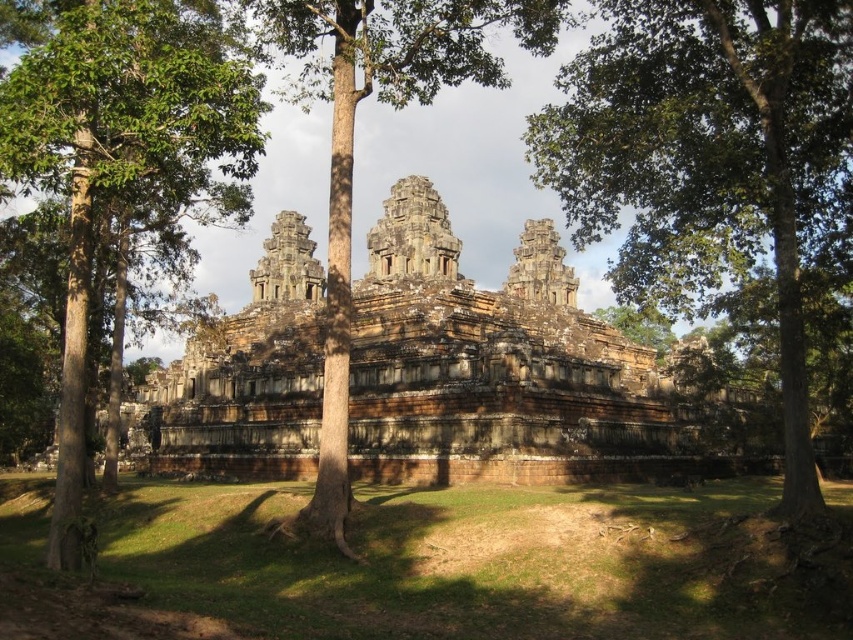
You are a visitor at the temple complex and want to take a photo of the temple without any obstruction. Which tree should you move closer to, the green leafy tree at left or the brown wood tree at center, to get a better view?

The green leafy tree at left has a lesser height compared to brown wood tree at center, so moving closer to the green leafy tree at left would provide a better unobstructed view of the temple as it is shorter.

You are standing at the point marked by the coordinate point (500, 369) in the ancient stone temple complex. What is the immediate structure you are standing on?

The immediate structure you are standing on is the brown stone ruins at center, which is represented by the coordinate point (500, 369).

You are a photographer aiming to capture the temple in the background. You notice the green leafy tree at left and the brown wood tree at center. Which tree is closer to the left edge of the photo?

The green leafy tree at left is closer to the left edge of the photo because it is positioned to the left of the brown wood tree at center.